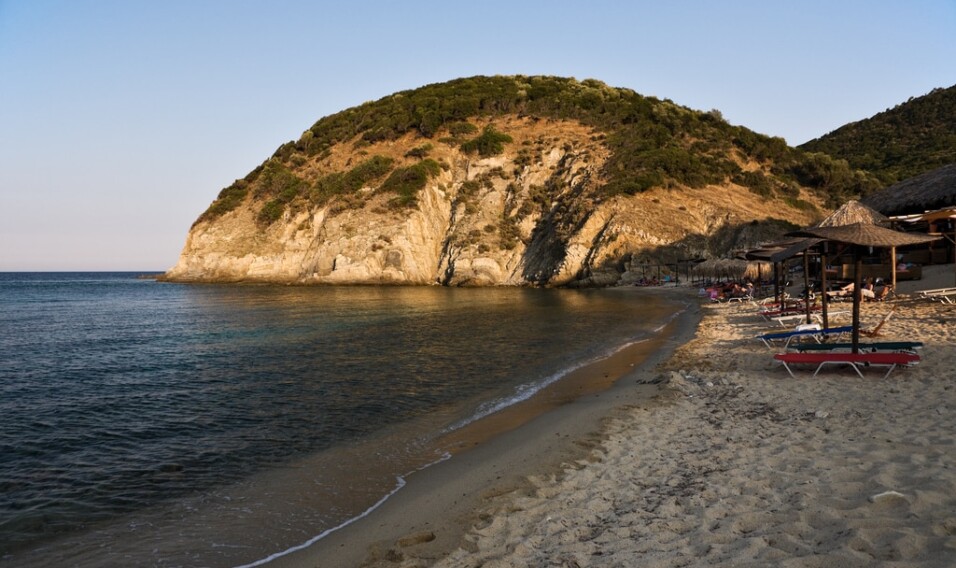
Find the location of a particular element. This screenshot has height=568, width=956. red chaise is located at coordinates (887, 357).